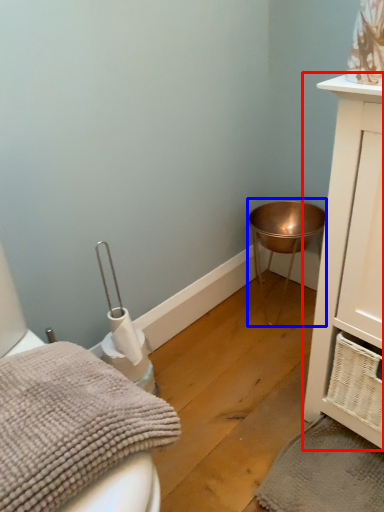
Question: Which point is further to the camera, bathroom cabinet (highlighted by a red box) or changing table (highlighted by a blue box)?

Choices:
 (A) bathroom cabinet
 (B) changing table

Answer: (B)